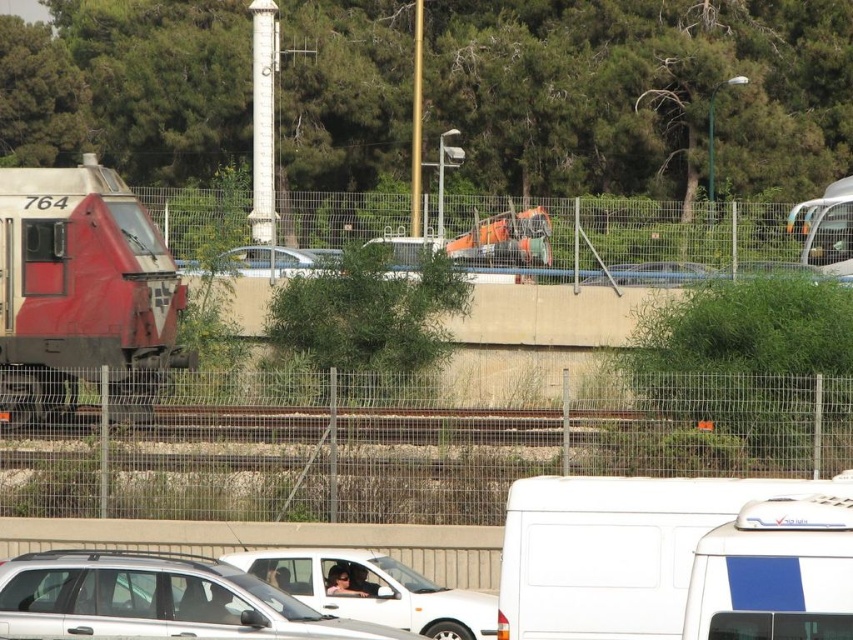
You are a pedestrian standing on the sidewalk near the railway. You see the matte red train at left and the white matte van at upper right. Which vehicle is closer to the railway tracks?

The matte red train at left is closer to the railway tracks because it is positioned to the left of the white matte van at upper right, which is further away from the tracks.

You are a pedestrian standing at the edge of the road near the fenced area. You see the silver metallic suv at center and the white matte car at center. Which vehicle is positioned higher relative to your viewpoint?

The silver metallic suv at center is positioned higher than the white matte car at center based on their spatial arrangement.

You are a delivery driver who needs to park your truck next to the silver metallic suv at center and the white matte car at center. Which vehicle should you park next to if you want to maximize the space available for your truck?

You should park next to the silver metallic suv at center because it has a larger size compared to the white matte car at center, providing more space for your truck.